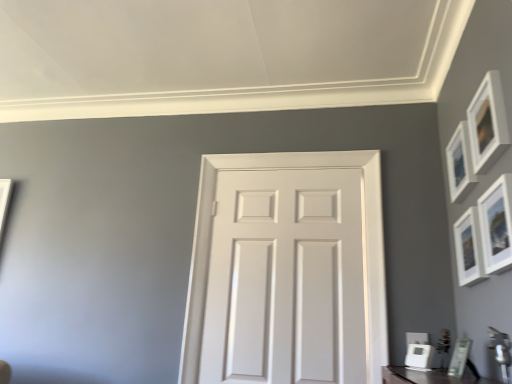
Question: Choose the correct answer: Is white glossy picture frame at lower right, the sixth picture frame viewed from the top, inside matte white picture frame at lower right, which ranks as the fifth picture frame in top-to-bottom order, or outside it?

Choices:
 (A) outside
 (B) inside

Answer: (A)

Question: From a real-world perspective, relative to matte white picture frame at lower right, which ranks as the second picture frame in bottom-to-top order, is white glossy picture frame at lower right, the sixth picture frame viewed from the top, vertically above or below?

Choices:
 (A) above
 (B) below

Answer: (B)

Question: Which of these objects is positioned farthest from the matte white picture frame at upper right, arranged as the third picture frame when viewed from the top?

Choices:
 (A) white matte picture frame at upper right, which is the third picture frame from bottom to top
 (B) white glossy picture frame at lower right, the sixth picture frame viewed from the top
 (C) white matte door at center
 (D) matte white picture frame at upper right, which is counted as the second picture frame, starting from the top
 (E) matte white picture frame at lower right, which ranks as the second picture frame in bottom-to-top order

Answer: (C)

Question: Estimate the real-world distances between objects in this image. Which object is closer to the white glossy picture frame at lower right, which is counted as the 1th picture frame, starting from the bottom?

Choices:
 (A) matte white picture frame at lower right, which ranks as the second picture frame in bottom-to-top order
 (B) white matte door at center
 (C) matte white picture frame at upper right, which is counted as the second picture frame, starting from the top
 (D) matte white picture frame at upper right, arranged as the third picture frame when viewed from the top
 (E) matte white picture frame at upper right, the first picture frame when ordered from top to bottom

Answer: (A)